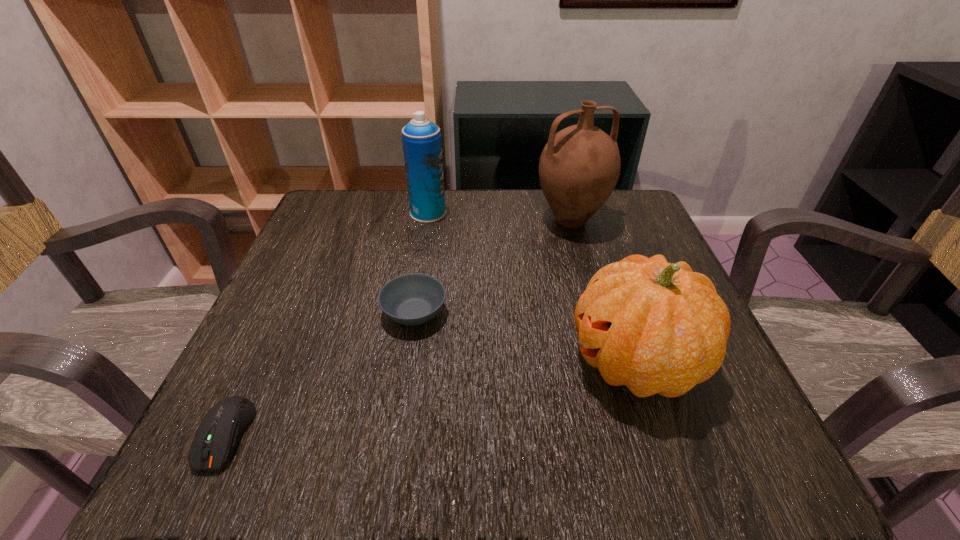
This screenshot has width=960, height=540. What are the coordinates of `unoccupied position between the pumpkin and the aerosol can` in the screenshot? It's located at (532, 287).

The image size is (960, 540). I want to click on empty location between the computer equipment and the pitcher, so click(x=398, y=327).

This screenshot has width=960, height=540. Identify the location of free point between the aerosol can and the pumpkin. (532, 287).

Locate an element on the screen. The height and width of the screenshot is (540, 960). empty location between the pitcher and the aerosol can is located at coordinates (499, 217).

Locate an element on the screen. The image size is (960, 540). vacant point located between the aerosol can and the shortest object is located at coordinates (327, 323).

This screenshot has height=540, width=960. In order to click on vacant area that lies between the leftmost object and the aerosol can in this screenshot , I will do `click(327, 323)`.

I want to click on object identified as the third closest to the aerosol can, so click(656, 327).

Identify which object is the second nearest to the aerosol can. Please provide its 2D coordinates. Your answer should be formatted as a tuple, i.e. [(x, y)], where the tuple contains the x and y coordinates of a point satisfying the conditions above.

[(412, 299)]

Find the location of a particular element. This screenshot has width=960, height=540. vacant space that satisfies the following two spatial constraints: 1. on the carved face of the pumpkin; 2. on the button of the shortest object is located at coordinates (660, 435).

Locate an element on the screen. The height and width of the screenshot is (540, 960). free location that satisfies the following two spatial constraints: 1. on the carved face of the pumpkin; 2. on the button of the leftmost object is located at coordinates (660, 435).